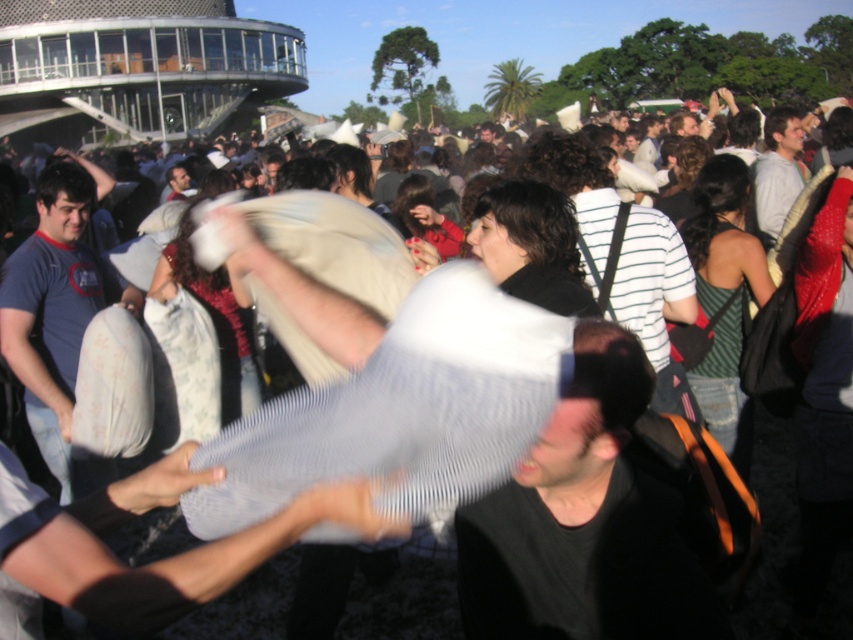
Question: Can you confirm if dark gray shirt at center is smaller than matte white pillow at left?

Choices:
 (A) no
 (B) yes

Answer: (B)

Question: Which point appears closest to the camera in this image?

Choices:
 (A) (73, 458)
 (B) (479, 554)

Answer: (B)

Question: Can you confirm if dark gray shirt at center is thinner than matte white pillow at left?

Choices:
 (A) no
 (B) yes

Answer: (A)

Question: Is dark gray shirt at center in front of matte white pillow at left?

Choices:
 (A) no
 (B) yes

Answer: (B)

Question: Among these points, which one is nearest to the camera?

Choices:
 (A) (665, 584)
 (B) (68, 275)

Answer: (A)